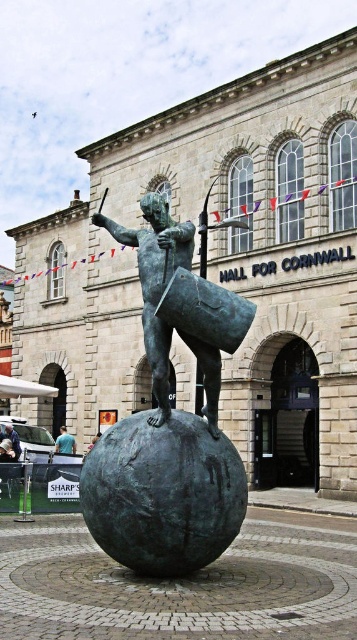
Measure the distance from bronze statue at center to light blue jeans at lower left.

bronze statue at center is 101.73 feet from light blue jeans at lower left.

Between bronze statue at center and light blue jeans at lower left, which one appears on the left side from the viewer's perspective?

light blue jeans at lower left

Does point (138, 477) come in front of point (17, 440)?

Yes, point (138, 477) is in front of point (17, 440).

In order to click on bronze statue at center in this screenshot , I will do `click(169, 419)`.

Which is below, bronze statue at center or light blue shirt at center?

light blue shirt at center is below.

Between point (178, 328) and point (72, 452), which one is positioned in front?

Positioned in front is point (178, 328).

Where is `bronze statue at center`? This screenshot has width=357, height=640. bronze statue at center is located at coordinates (169, 419).

Between point (68, 444) and point (16, 451), which one is positioned behind?

The point (68, 444) is more distant.

Is point (62, 436) in front of point (13, 438)?

No.

Where is `light blue shirt at center`? light blue shirt at center is located at coordinates (64, 442).